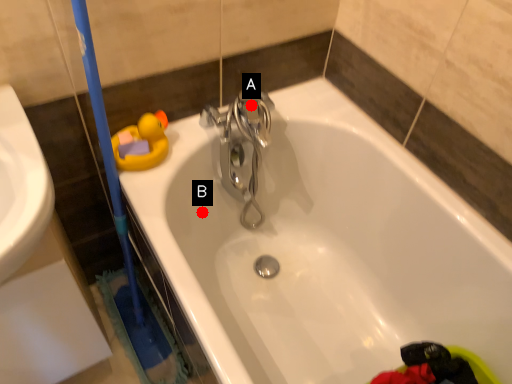
Question: Two points are circled on the image, labeled by A and B beside each circle. Which of the following is the closest to the observer?

Choices:
 (A) A is closer
 (B) B is closer

Answer: (A)